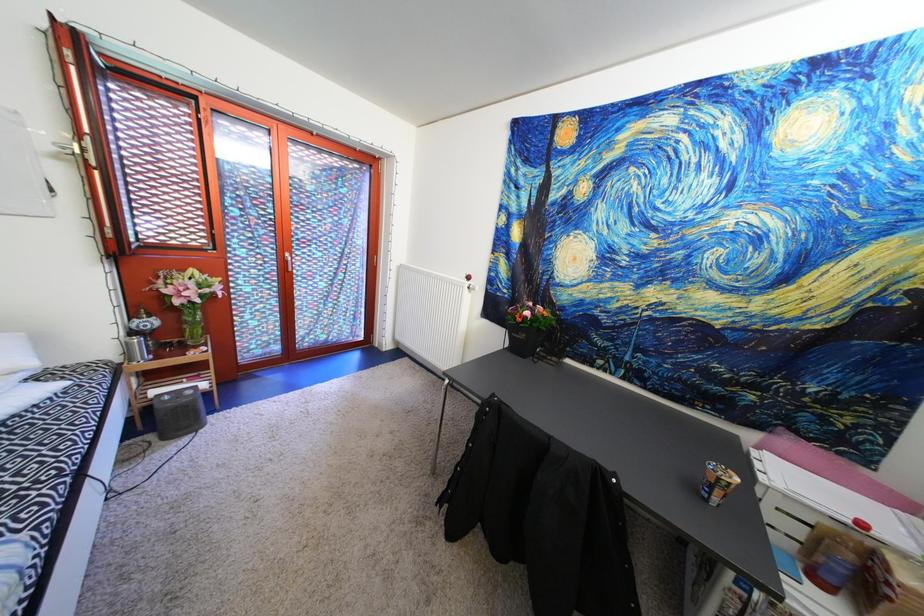
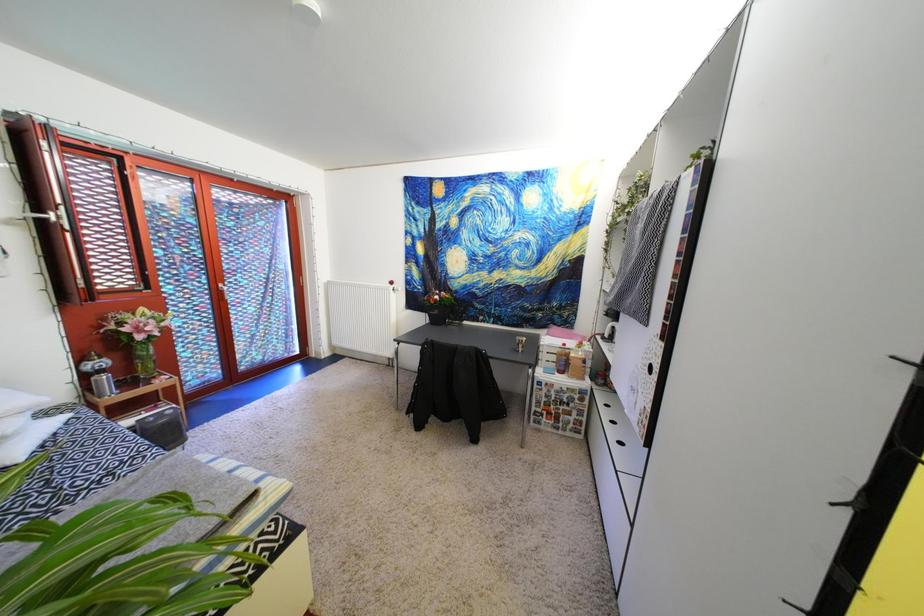
Question: What movement of the cameraman would produce the second image?

Choices:
 (A) Left
 (B) Right
 (C) Forward
 (D) Backward

Answer: (D)